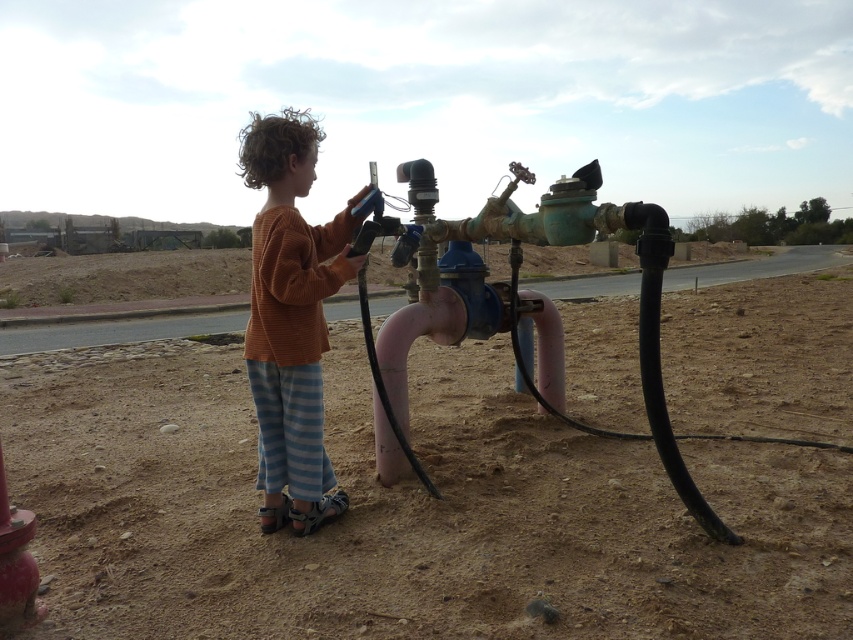
The child is trying to reach the water meter pipes. Considering the positions of the dull brown dirt at center and the brown sweater at center, which object is higher and might block the child from accessing the pipes?

The dull brown dirt at center is much taller than the brown sweater at center, so the dull brown dirt at center might block the child from accessing the pipes.

You are a delivery person trying to deliver a package to the address shown in the image. The package can only be placed where there is enough space. Based on the scene, can you place the package between the brown sweater at center and the matte red hydrant at lower left?

The brown sweater at center is bigger than the matte red hydrant at lower left, so there might be sufficient space between them to place the package.

Consider the image. You are a parent trying to ensure your child stays safe while playing near the water meter. The child is wearing a brown sweater at center and standing on dull brown dirt at center. Which object is located to the right of the child?

The dull brown dirt at center is positioned on the right side of brown sweater at center, so the dull brown dirt at center is to the right of the child wearing the brown sweater at center.